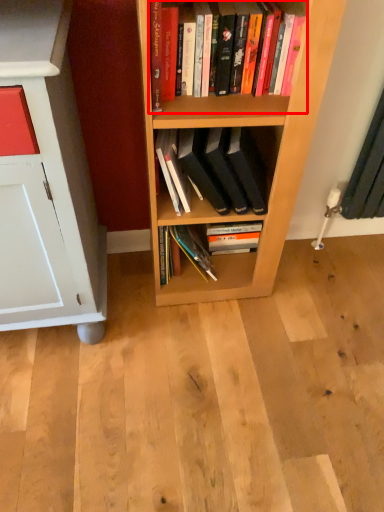
Question: Where is book (annotated by the red box) located in relation to book in the image?

Choices:
 (A) right
 (B) left

Answer: (A)